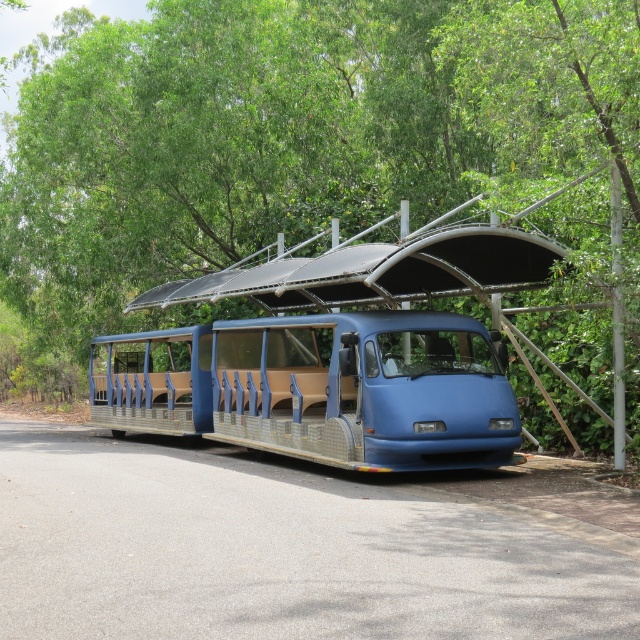
Question: From the image, what is the correct spatial relationship of green leafy tree at upper center in relation to blue matte/tactile tour bus at center?

Choices:
 (A) left
 (B) right

Answer: (A)

Question: Does green leafy tree at upper center have a smaller size compared to blue matte/tactile tour bus at center?

Choices:
 (A) yes
 (B) no

Answer: (B)

Question: Is green leafy tree at upper center wider than blue matte/tactile tour bus at center?

Choices:
 (A) no
 (B) yes

Answer: (B)